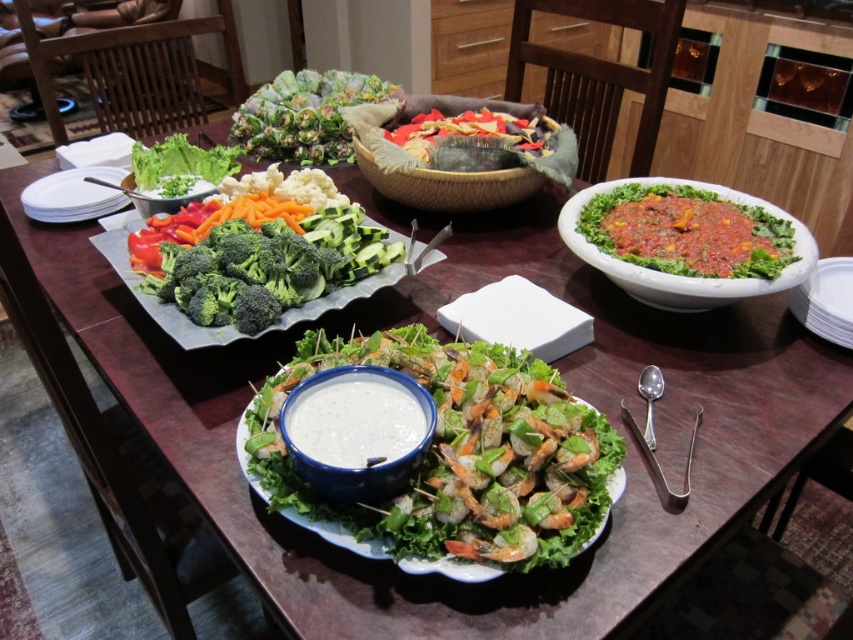
Image resolution: width=853 pixels, height=640 pixels. What do you see at coordinates (357, 432) in the screenshot? I see `white matte bowl at center` at bounding box center [357, 432].

Is point (306, 433) positioned before point (207, 192)?

Yes, it is.

The height and width of the screenshot is (640, 853). Identify the location of white matte bowl at center. coord(357,432).

Can you confirm if white matte bowl at center is positioned to the left of green fresh broccoli at center?

Incorrect, white matte bowl at center is not on the left side of green fresh broccoli at center.

Who is more distant from viewer, (344, 369) or (238, 280)?

Point (238, 280)

Locate an element on the screen. Image resolution: width=853 pixels, height=640 pixels. white matte bowl at center is located at coordinates (357, 432).

Identify the location of white matte bowl at center. The image size is (853, 640). (357, 432).

Is point (363, 440) positioned before point (608, 180)?

That is True.

Is white matte bowl at center smaller than green leafy salad at right?

Correct, white matte bowl at center occupies less space than green leafy salad at right.

Describe the element at coordinates (357, 432) in the screenshot. I see `white matte bowl at center` at that location.

Locate an element on the screen. This screenshot has width=853, height=640. white matte bowl at center is located at coordinates (357, 432).